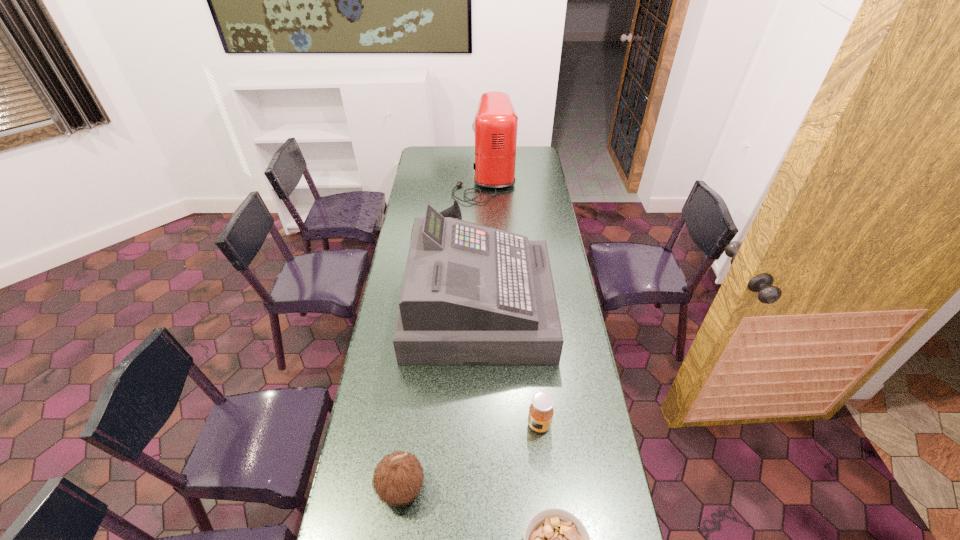
I want to click on vacant region at the left edge of the desktop, so click(373, 415).

At what (x,y) coordinates should I click in order to perform the action: click on free location at the right edge of the desktop. Please return your answer as a coordinate pair (x, y). Looking at the image, I should click on (586, 507).

Where is `free region at the far right corner of the desktop`? Image resolution: width=960 pixels, height=540 pixels. free region at the far right corner of the desktop is located at coordinates (540, 163).

Image resolution: width=960 pixels, height=540 pixels. What are the coordinates of `object that can be found as the fifth closest to the honey` in the screenshot? It's located at (495, 127).

The height and width of the screenshot is (540, 960). I want to click on object that is the fifth nearest to the shortest object, so click(x=495, y=127).

The image size is (960, 540). I want to click on vacant area in the image that satisfies the following two spatial constraints: 1. on the front-facing side of the honey; 2. on the surface of the coconut, so click(x=545, y=488).